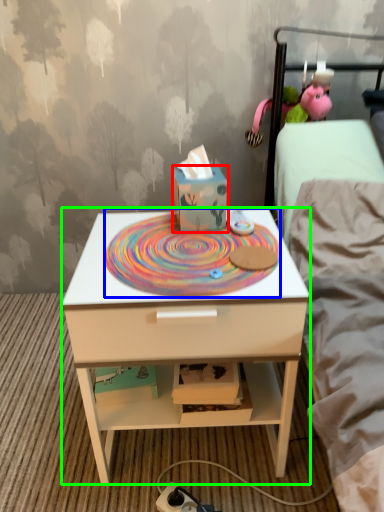
Question: Considering the real-world distances, which object is farthest from cardboard box (highlighted by a red box)? design (highlighted by a blue box) or nightstand (highlighted by a green box)?

Choices:
 (A) design
 (B) nightstand

Answer: (B)